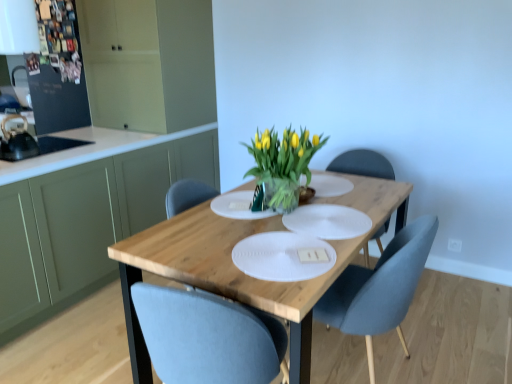
Measure the distance between point (4, 248) and camera.

The distance of point (4, 248) from camera is 2.17 meters.

Measure the distance between point (109, 64) and camera.

Point (109, 64) is 3.18 meters away from camera.

How much space does green matte cabinet at left, placed as the 2th cabinetry when sorted from bottom to top, occupy vertically?

It is 1.75 meters.

What is the approximate height of matte black refrigerator at upper left, the 2th appliance positioned from the bottom?

matte black refrigerator at upper left, the 2th appliance positioned from the bottom, is 25.99 inches tall.

In order to face white textured placemat at center, should I rotate leftwards or rightwards?

It's best to rotate right around 9.714 degrees.

Image resolution: width=512 pixels, height=384 pixels. I want to click on wooden table at center, so click(x=239, y=270).

The height and width of the screenshot is (384, 512). Describe the element at coordinates (17, 141) in the screenshot. I see `black matte kettle at left, which appears as the second appliance when viewed from the top` at that location.

Identify the location of green matte cabinet at left, the second cabinetry positioned from the top. (86, 223).

In terms of size, does green matte cabinet at left, the second cabinetry positioned from the top, appear bigger or smaller than green matte cabinet at left, placed as the 2th cabinetry when sorted from bottom to top?

In the image, green matte cabinet at left, the second cabinetry positioned from the top, appears to be smaller than green matte cabinet at left, placed as the 2th cabinetry when sorted from bottom to top.

From a real-world perspective, between green matte cabinet at left, which is the 1th cabinetry in bottom-to-top order, and green matte cabinet at left, which is the 1th cabinetry from top to bottom, who is vertically lower?

From a 3D spatial view, green matte cabinet at left, which is the 1th cabinetry in bottom-to-top order, is below.

From the image's perspective, is green matte cabinet at left, the second cabinetry positioned from the top, located beneath green matte cabinet at left, placed as the 2th cabinetry when sorted from bottom to top?

Yes, from the image's perspective, green matte cabinet at left, the second cabinetry positioned from the top, is beneath green matte cabinet at left, placed as the 2th cabinetry when sorted from bottom to top.

Where is `cabinetry below the green matte cabinet at left, which is the 1th cabinetry from top to bottom (from the image's perspective)`? The image size is (512, 384). cabinetry below the green matte cabinet at left, which is the 1th cabinetry from top to bottom (from the image's perspective) is located at coordinates (86, 223).

What's the angular difference between matte gray chair at center and matte black refrigerator at upper left, the first appliance in the top-to-bottom sequence,'s facing directions?

matte gray chair at center and matte black refrigerator at upper left, the first appliance in the top-to-bottom sequence, are facing 84.7 degrees away from each other.

Locate an element on the screen. The image size is (512, 384). chair below the matte black refrigerator at upper left, the 2th appliance positioned from the bottom (from the image's perspective) is located at coordinates (379, 288).

Does matte gray chair at center have a smaller size compared to matte black refrigerator at upper left, the 2th appliance positioned from the bottom?

Actually, matte gray chair at center might be larger than matte black refrigerator at upper left, the 2th appliance positioned from the bottom.

Between green matte cabinet at left, which is the 1th cabinetry from top to bottom, and green matte cabinet at left, which is the 1th cabinetry in bottom-to-top order, which one is positioned behind?

green matte cabinet at left, which is the 1th cabinetry from top to bottom, is further from the camera.

From the picture: Is green matte cabinet at left, which is the 1th cabinetry in bottom-to-top order, inside green matte cabinet at left, which is the 1th cabinetry from top to bottom?

No, green matte cabinet at left, which is the 1th cabinetry from top to bottom, does not contain green matte cabinet at left, which is the 1th cabinetry in bottom-to-top order.

From the image's perspective, between green matte cabinet at left, placed as the 2th cabinetry when sorted from bottom to top, and green matte cabinet at left, the second cabinetry positioned from the top, who is located below?

green matte cabinet at left, the second cabinetry positioned from the top.

Considering the sizes of objects white textured placemat at center and green matte cabinet at left, which is the 1th cabinetry in bottom-to-top order, in the image provided, who is smaller, white textured placemat at center or green matte cabinet at left, which is the 1th cabinetry in bottom-to-top order,?

Smaller between the two is white textured placemat at center.

Is white textured placemat at center far away from green matte cabinet at left, which is the 1th cabinetry in bottom-to-top order?

white textured placemat at center is positioned a significant distance from green matte cabinet at left, which is the 1th cabinetry in bottom-to-top order.

From the white textured placemat at center, count 1st cabinetrys backward and point to it. Please provide its 2D coordinates.

[(86, 223)]

Between white textured placemat at center and green matte cabinet at left, which is the 1th cabinetry in bottom-to-top order, which one has more height?

green matte cabinet at left, which is the 1th cabinetry in bottom-to-top order.

From a real-world perspective, does matte gray chair at center sit lower than white textured placemat at center?

Correct, in the physical world, matte gray chair at center is lower than white textured placemat at center.

Is white textured placemat at center at the back of matte gray chair at center?

matte gray chair at center does not have its back to white textured placemat at center.

Between point (344, 307) and point (303, 229), which one is positioned behind?

Point (303, 229)

Looking at their sizes, would you say matte gray chair at center is wider or thinner than white textured placemat at center?

Clearly, matte gray chair at center has more width compared to white textured placemat at center.

Which is more to the left, green matte cabinet at left, the second cabinetry positioned from the top, or black matte kettle at left, which ranks as the second appliance in back-to-front order?

black matte kettle at left, which ranks as the second appliance in back-to-front order, is more to the left.

Is green matte cabinet at left, which is the 1th cabinetry in bottom-to-top order, aimed at black matte kettle at left, the 1th appliance from the front?

No, green matte cabinet at left, which is the 1th cabinetry in bottom-to-top order, does not turn towards black matte kettle at left, the 1th appliance from the front.

Looking at this image, what's the angular difference between green matte cabinet at left, which is the 1th cabinetry in bottom-to-top order, and black matte kettle at left, which appears as the second appliance when viewed from the top,'s facing directions?

The angle between the facing direction of green matte cabinet at left, which is the 1th cabinetry in bottom-to-top order, and the facing direction of black matte kettle at left, which appears as the second appliance when viewed from the top, is 0.417 degrees.

From the image's perspective, which one is positioned lower, white textured placemat at center or translucent glass vase at center?

white textured placemat at center appears lower in the image.

Consider the image. How many degrees apart are the facing directions of white textured placemat at center and translucent glass vase at center?

0.628 degrees separate the facing orientations of white textured placemat at center and translucent glass vase at center.

Based on the photo, between white textured placemat at center and translucent glass vase at center, which one appears on the right side from the viewer's perspective?

white textured placemat at center.

In terms of height, does white textured placemat at center look taller or shorter compared to translucent glass vase at center?

white textured placemat at center is shorter than translucent glass vase at center.

At what (x,y) coordinates should I click in order to perform the action: click on cabinetry that appears above the green matte cabinet at left, which is the 1th cabinetry in bottom-to-top order (from the image's perspective). Please return your answer as a coordinate pair (x, y). Image resolution: width=512 pixels, height=384 pixels. Looking at the image, I should click on (148, 63).

Find the location of a particular element. chair below the matte black refrigerator at upper left, arranged as the first appliance when viewed from the back (from a real-world perspective) is located at coordinates (379, 288).

Estimate the real-world distances between objects in this image. Which object is closer to green matte cabinet at left, which is the 1th cabinetry from top to bottom, wooden table at center or matte gray chair at center?

wooden table at center is positioned closer to the anchor green matte cabinet at left, which is the 1th cabinetry from top to bottom.

Considering their positions, is green matte cabinet at left, which is the 1th cabinetry from top to bottom, positioned closer to translucent glass vase at center than matte black refrigerator at upper left, arranged as the first appliance when viewed from the back?

green matte cabinet at left, which is the 1th cabinetry from top to bottom, is closer to translucent glass vase at center.

When comparing their distances from green matte cabinet at left, which is the 1th cabinetry from top to bottom, does green matte cabinet at left, the second cabinetry positioned from the top, or matte gray chair at center seem further?

Based on the image, matte gray chair at center appears to be further to green matte cabinet at left, which is the 1th cabinetry from top to bottom.

When comparing their distances from black matte kettle at left, which appears as the second appliance when viewed from the top, does matte black refrigerator at upper left, the 2th appliance positioned from the bottom, or white textured placemat at center seem further?

Among the two, white textured placemat at center is located further to black matte kettle at left, which appears as the second appliance when viewed from the top.

Looking at the image, which one is located closer to wooden table at center, green matte cabinet at left, which is the 1th cabinetry in bottom-to-top order, or matte gray chair at center?

matte gray chair at center lies closer to wooden table at center than the other object.

From the image, which object appears to be nearer to translucent glass vase at center, black matte kettle at left, marked as the first appliance in a bottom-to-top arrangement, or matte gray chair at center?

matte gray chair at center is closer to translucent glass vase at center.

Which object lies further to the anchor point green matte cabinet at left, which is the 1th cabinetry in bottom-to-top order, black matte kettle at left, marked as the first appliance in a bottom-to-top arrangement, or translucent glass vase at center?

The object further to green matte cabinet at left, which is the 1th cabinetry in bottom-to-top order, is translucent glass vase at center.

Estimate the real-world distances between objects in this image. Which object is further from wooden table at center, green matte cabinet at left, placed as the 2th cabinetry when sorted from bottom to top, or matte gray chair at center?

green matte cabinet at left, placed as the 2th cabinetry when sorted from bottom to top, lies further to wooden table at center than the other object.

This screenshot has width=512, height=384. In order to click on glass plate between translucent glass vase at center and wooden table at center from top to bottom in this screenshot , I will do `click(328, 221)`.

Where is `houseplant between white textured placemat at center and green matte cabinet at left, which is the 1th cabinetry from top to bottom, along the z-axis`? The width and height of the screenshot is (512, 384). houseplant between white textured placemat at center and green matte cabinet at left, which is the 1th cabinetry from top to bottom, along the z-axis is located at coordinates (283, 164).

At what (x,y) coordinates should I click in order to perform the action: click on appliance located between matte black refrigerator at upper left, the first appliance in the top-to-bottom sequence, and white textured placemat at center in the left-right direction. Please return your answer as a coordinate pair (x, y). Looking at the image, I should click on (17, 141).

Identify the location of glass plate between matte gray chair at center and green matte cabinet at left, placed as the 2th cabinetry when sorted from bottom to top, from front to back. click(x=328, y=221).